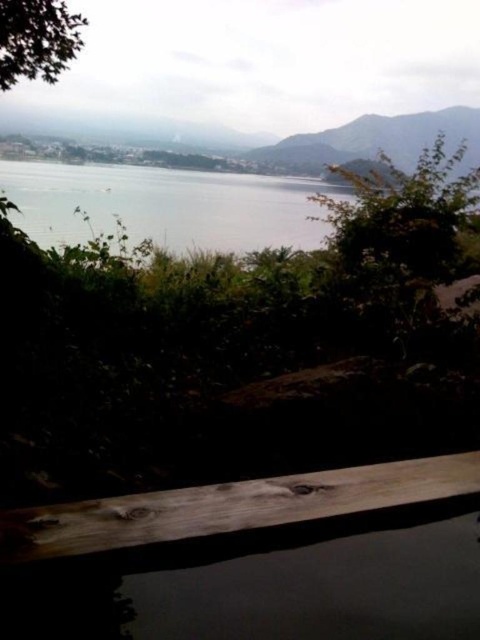
Question: Is brown wood rail at lower center behind clear water at center?

Choices:
 (A) yes
 (B) no

Answer: (B)

Question: Among these points, which one is nearest to the camera?

Choices:
 (A) (261, 502)
 (B) (36, 198)

Answer: (A)

Question: Can you confirm if brown wood rail at lower center is smaller than clear water at center?

Choices:
 (A) yes
 (B) no

Answer: (A)

Question: Which point is farther from the camera taking this photo?

Choices:
 (A) (49, 243)
 (B) (336, 470)

Answer: (A)

Question: Where is brown wood rail at lower center located in relation to clear water at center in the image?

Choices:
 (A) left
 (B) right

Answer: (B)